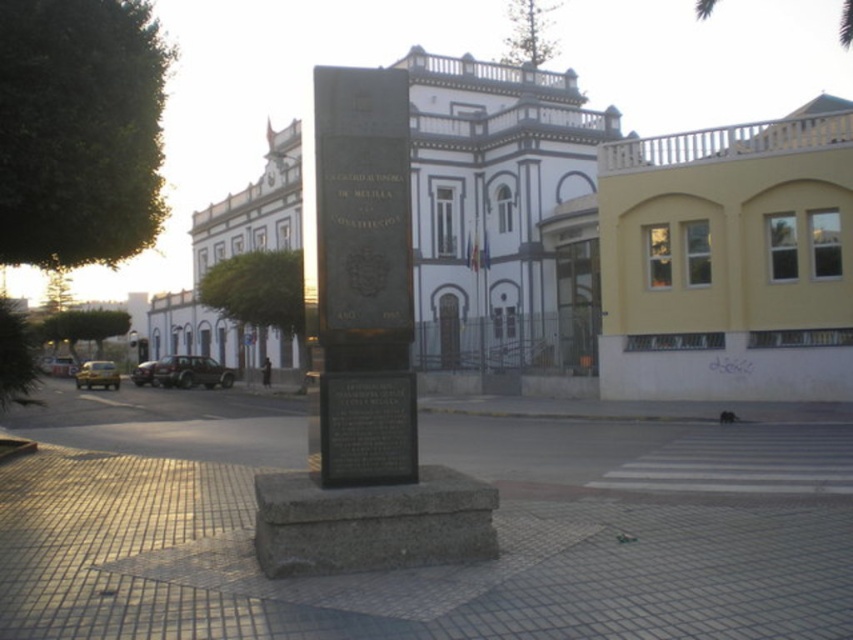
Does black granite monument at center appear on the left side of green leafy palm tree at upper center?

Correct, you'll find black granite monument at center to the left of green leafy palm tree at upper center.

Which is behind, point (405, 284) or point (701, 1)?

Point (701, 1)

The height and width of the screenshot is (640, 853). Identify the location of black granite monument at center. (363, 358).

Identify the location of black granite monument at center. (363, 358).

Is point (274, 483) positioned after point (338, 384)?

Yes, point (274, 483) is farther from viewer.

This screenshot has height=640, width=853. Find the location of `black granite monument at center`. black granite monument at center is located at coordinates (363, 358).

Which is in front, point (335, 429) or point (714, 1)?

Point (335, 429) is in front.

Is point (376, 445) more distant than point (848, 13)?

No, (376, 445) is closer to viewer.

You are a GUI agent. You are given a task and a screenshot of the screen. Output one action in this format:
    pyautogui.click(x=<x>, y=<y>)
    Task: Click on the black stone plaque at center
    The width and height of the screenshot is (853, 640).
    Given the screenshot: What is the action you would take?
    pyautogui.click(x=364, y=428)